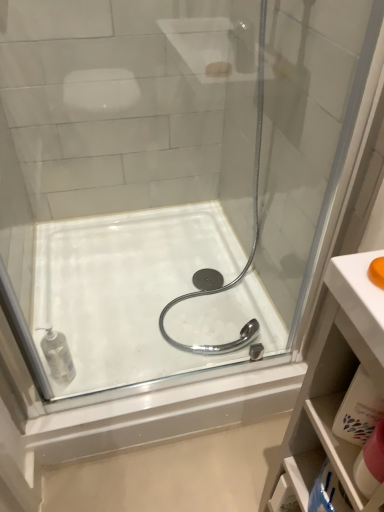
Question: Would you say pink fabric towel at lower right, placed as the second toiletry when sorted from left to right, contains clear plastic soap dispenser at lower left, positioned as the 1th toiletry in left-to-right order?

Choices:
 (A) no
 (B) yes

Answer: (A)

Question: Considering the relative sizes of pink fabric towel at lower right, placed as the 1th toiletry when sorted from right to left, and clear plastic soap dispenser at lower left, which is the second toiletry in front-to-back order, in the image provided, is pink fabric towel at lower right, placed as the 1th toiletry when sorted from right to left, thinner than clear plastic soap dispenser at lower left, which is the second toiletry in front-to-back order,?

Choices:
 (A) yes
 (B) no

Answer: (A)

Question: Is pink fabric towel at lower right, placed as the 2th toiletry when sorted from back to front, taller than clear plastic soap dispenser at lower left, which is the second toiletry in front-to-back order?

Choices:
 (A) yes
 (B) no

Answer: (B)

Question: Can you confirm if pink fabric towel at lower right, placed as the 2th toiletry when sorted from back to front, is shorter than clear plastic soap dispenser at lower left, which is the second toiletry in front-to-back order?

Choices:
 (A) yes
 (B) no

Answer: (A)

Question: Can you confirm if pink fabric towel at lower right, placed as the 1th toiletry when sorted from right to left, is smaller than clear plastic soap dispenser at lower left, which is the second toiletry in front-to-back order?

Choices:
 (A) yes
 (B) no

Answer: (A)

Question: From a real-world perspective, relative to clear plastic soap dispenser at lower left, positioned as the 1th toiletry in left-to-right order, is white plastic cabinet at lower right vertically above or below?

Choices:
 (A) above
 (B) below

Answer: (A)

Question: In terms of width, does white plastic cabinet at lower right look wider or thinner when compared to clear plastic soap dispenser at lower left, marked as the first toiletry in a back-to-front arrangement?

Choices:
 (A) wide
 (B) thin

Answer: (A)

Question: Would you say white plastic cabinet at lower right is to the left or to the right of clear plastic soap dispenser at lower left, which is the second toiletry in front-to-back order, in the picture?

Choices:
 (A) right
 (B) left

Answer: (A)

Question: Does point (352, 356) appear closer or farther from the camera than point (61, 342)?

Choices:
 (A) closer
 (B) farther

Answer: (A)

Question: In terms of height, does clear plastic soap dispenser at lower left, positioned as the 1th toiletry in left-to-right order, look taller or shorter compared to pink fabric towel at lower right, placed as the 1th toiletry when sorted from right to left?

Choices:
 (A) short
 (B) tall

Answer: (B)

Question: From the image's perspective, is clear plastic soap dispenser at lower left, marked as the first toiletry in a back-to-front arrangement, positioned above or below pink fabric towel at lower right, which is counted as the first toiletry, starting from the front?

Choices:
 (A) above
 (B) below

Answer: (A)

Question: Does point (59, 377) appear closer or farther from the camera than point (365, 484)?

Choices:
 (A) farther
 (B) closer

Answer: (A)

Question: In the image, is clear plastic soap dispenser at lower left, marked as the first toiletry in a back-to-front arrangement, on the left side or the right side of pink fabric towel at lower right, placed as the 2th toiletry when sorted from back to front?

Choices:
 (A) left
 (B) right

Answer: (A)

Question: Do you think white glossy bath at center is within white plastic cabinet at lower right, or outside of it?

Choices:
 (A) inside
 (B) outside

Answer: (B)

Question: Does point (112, 346) appear closer or farther from the camera than point (283, 446)?

Choices:
 (A) farther
 (B) closer

Answer: (A)